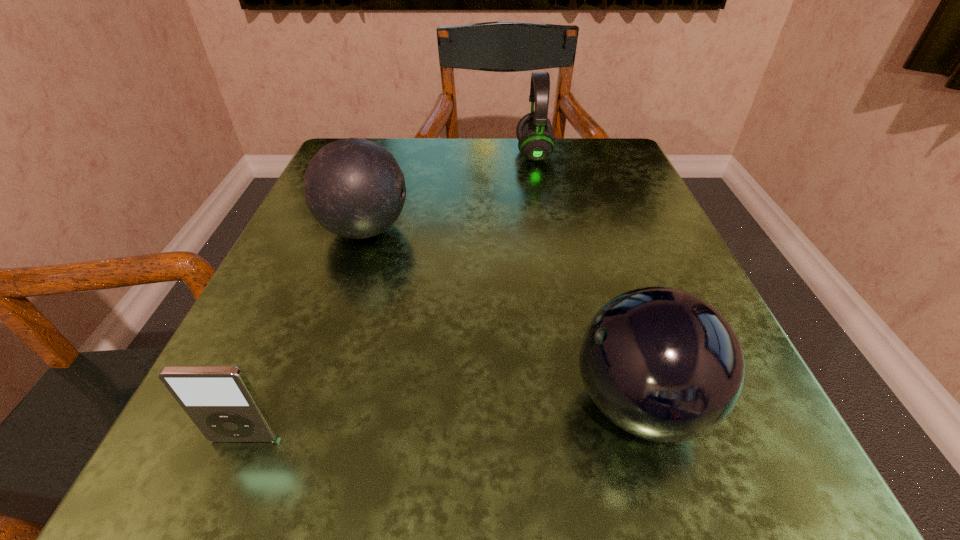
At what (x,y) coordinates should I click in order to perform the action: click on free space in the image that satisfies the following two spatial constraints: 1. on the grip area of the left bowling ball; 2. on the front-facing side of the shortest object. Please return your answer as a coordinate pair (x, y). Looking at the image, I should click on (297, 438).

Where is `free space that satisfies the following two spatial constraints: 1. on the grip area of the left bowling ball; 2. on the front-facing side of the shortest object`? free space that satisfies the following two spatial constraints: 1. on the grip area of the left bowling ball; 2. on the front-facing side of the shortest object is located at coordinates (297, 438).

The image size is (960, 540). I want to click on free location that satisfies the following two spatial constraints: 1. on the grip area of the third nearest object; 2. on the front-facing side of the iPod, so click(x=297, y=438).

In order to click on free location that satisfies the following two spatial constraints: 1. on the side of the right bowling ball with the finger holes; 2. on the front-facing side of the shortest object in this screenshot , I will do `click(650, 438)`.